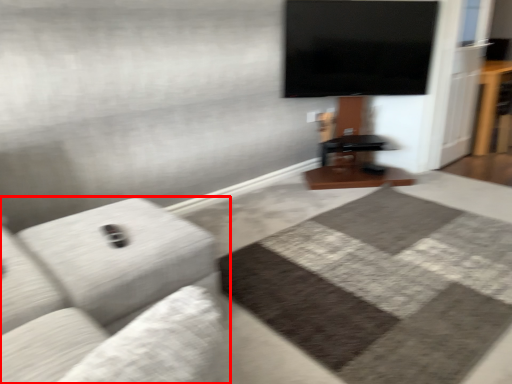
Question: From the image's perspective, considering the relative positions of studio couch (annotated by the red box) and table in the image provided, where is studio couch (annotated by the red box) located with respect to the staircase?

Choices:
 (A) below
 (B) above

Answer: (A)